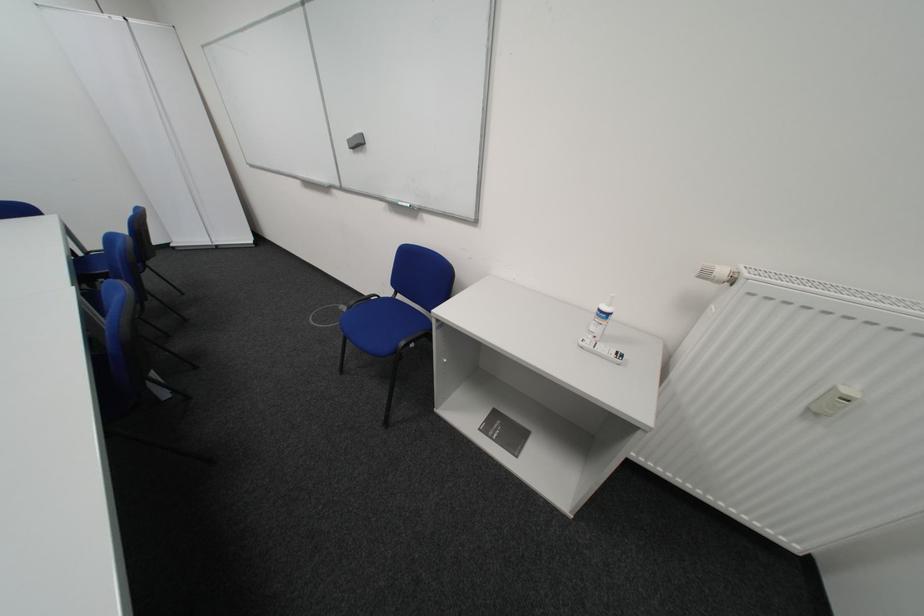
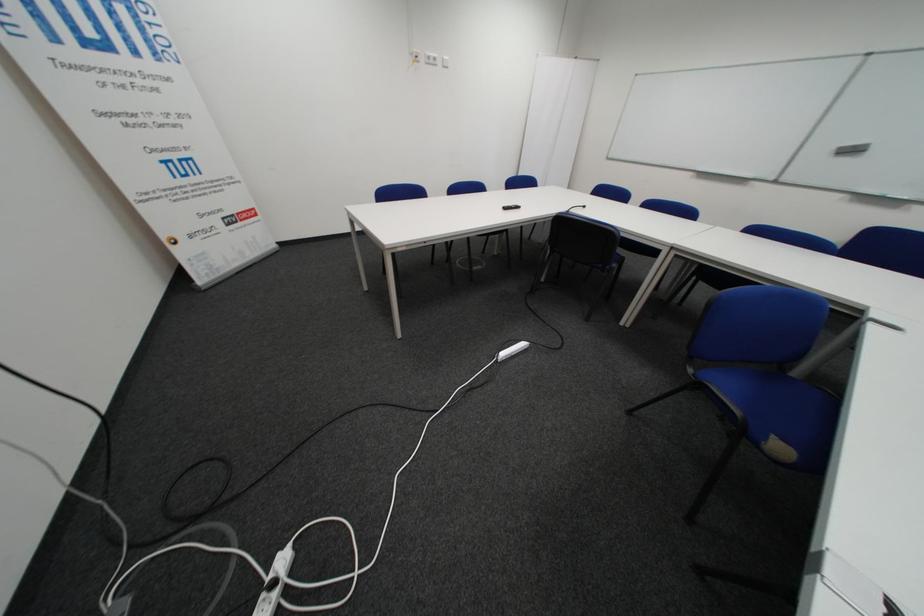
In a continuous first-person perspective shot, in which direction is the camera moving?

The cameraman moved toward left, backward.